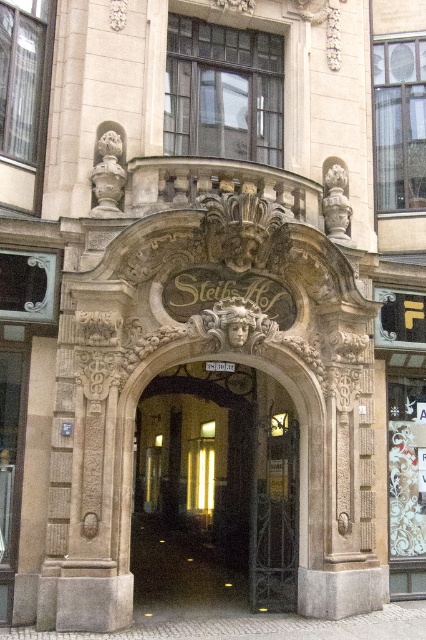
You are standing in front of a historic building and want to take a photo of the dark brown stone archway at center. If your camera has a maximum focus range of 25 meters, will it be able to capture the archway clearly?

The dark brown stone archway at center is 24.79 meters away from the viewer. Since the camera can focus up to 25 meters, it will be able to capture the archway clearly within its range.

You are an architect analyzing the entrance of a historic building. You notice the dark brown stone archway at center and the matte glass door at center. Which of these two elements is more prominent in terms of visual size?

The dark brown stone archway at center has a larger size compared to the matte glass door at center, making it more prominent in visual size.

In the scene shown: Based on the scene description, where is the dark brown stone archway at center located in terms of its 2D coordinates?

The dark brown stone archway at center is located at the 2D coordinates of point (218, 480).